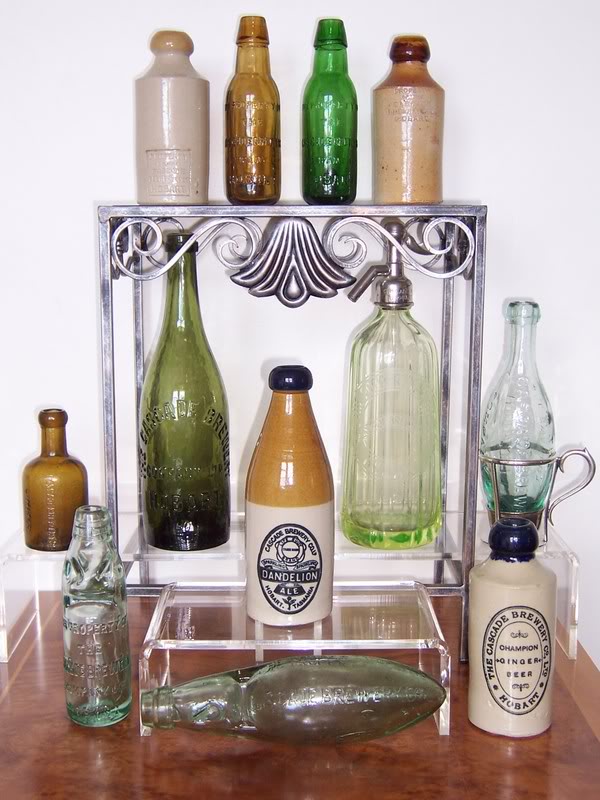
Where is `large green wine bottle`? large green wine bottle is located at coordinates (186, 378).